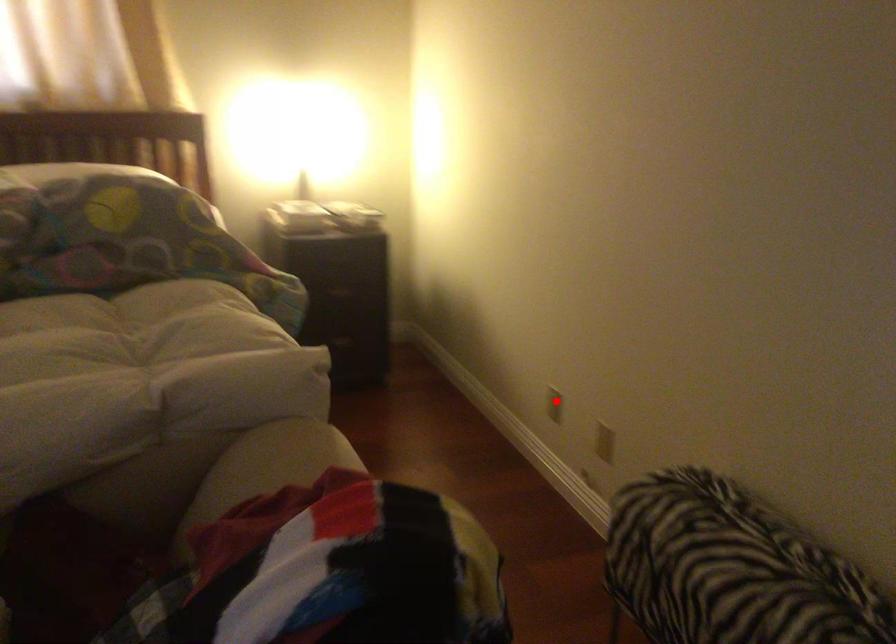
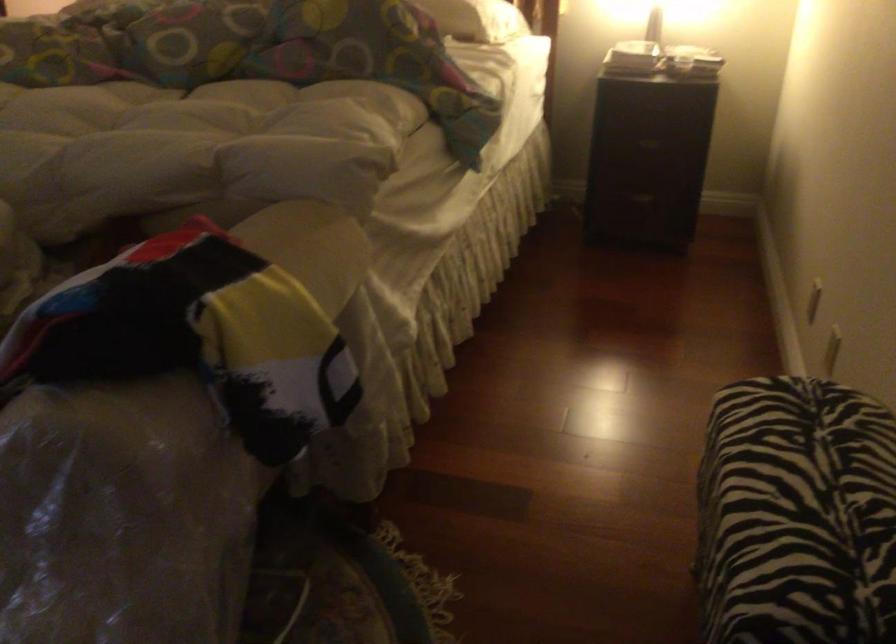
Where in the second image is the point corresponding to the highlighted location from the first image?

(814, 301)